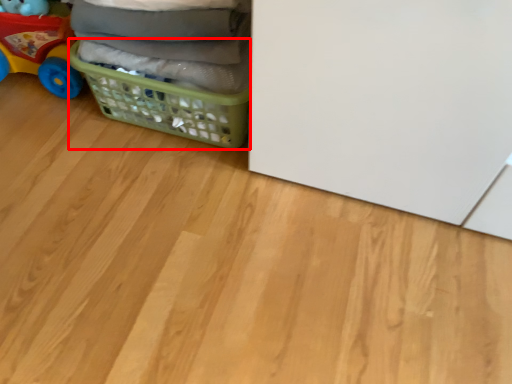
Question: From the image, what is the correct spatial relationship of basket (annotated by the red box) in relation to toy?

Choices:
 (A) left
 (B) right

Answer: (B)